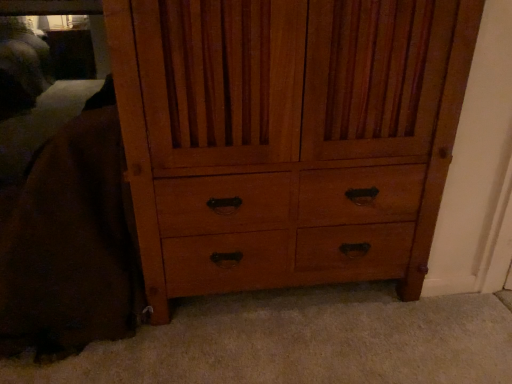
What is the approximate width of wooden cabinet at center?

wooden cabinet at center is 27.36 inches wide.

At what (x,y) coordinates should I click in order to perform the action: click on wooden cabinet at center. Please return your answer as a coordinate pair (x, y). Looking at the image, I should click on 287,137.

The image size is (512, 384). Describe the element at coordinates (287, 137) in the screenshot. I see `wooden cabinet at center` at that location.

Identify the location of wooden cabinet at center. The width and height of the screenshot is (512, 384). (287, 137).